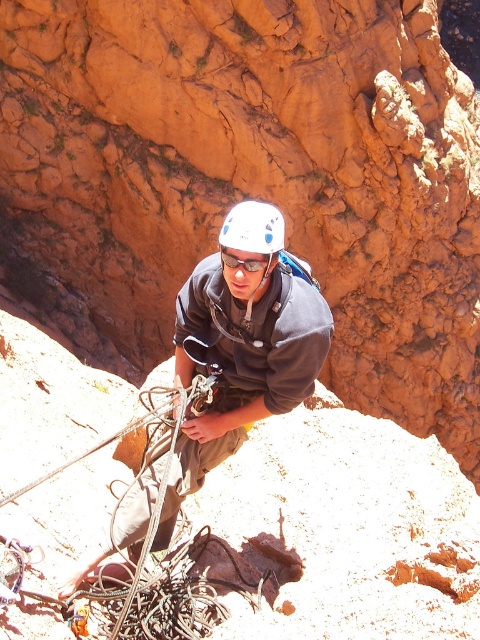
Is matte gray helmet at center positioned before clear plastic goggles at center?

No, it is behind clear plastic goggles at center.

The image size is (480, 640). What do you see at coordinates (241, 346) in the screenshot?
I see `matte gray helmet at center` at bounding box center [241, 346].

Which is in front, point (253, 419) or point (264, 260)?

Point (264, 260)

Where is `matte gray helmet at center`? The height and width of the screenshot is (640, 480). matte gray helmet at center is located at coordinates (241, 346).

Does matte gray helmet at center have a lesser width compared to white matte helmet at center?

Correct, matte gray helmet at center's width is less than white matte helmet at center's.

Can you confirm if matte gray helmet at center is positioned above white matte helmet at center?

Actually, matte gray helmet at center is below white matte helmet at center.

Is point (292, 333) positioned in front of point (252, 221)?

No, (292, 333) is behind (252, 221).

Where is `matte gray helmet at center`? The height and width of the screenshot is (640, 480). matte gray helmet at center is located at coordinates (241, 346).

Does white matte helmet at center appear over clear plastic goggles at center?

Yes, white matte helmet at center is above clear plastic goggles at center.

Between point (240, 230) and point (252, 259), which one is positioned behind?

Point (252, 259)

The width and height of the screenshot is (480, 640). In order to click on white matte helmet at center in this screenshot , I will do `click(252, 230)`.